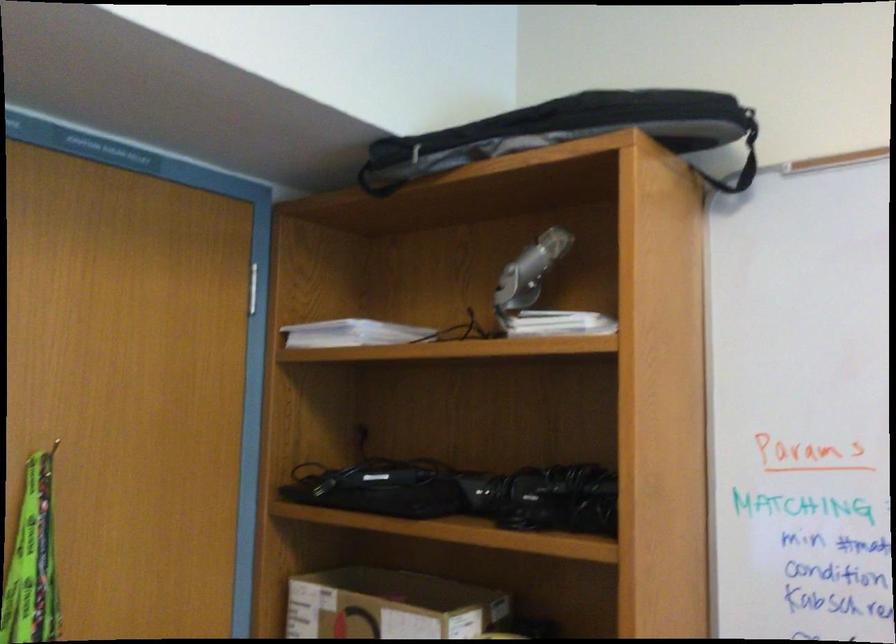
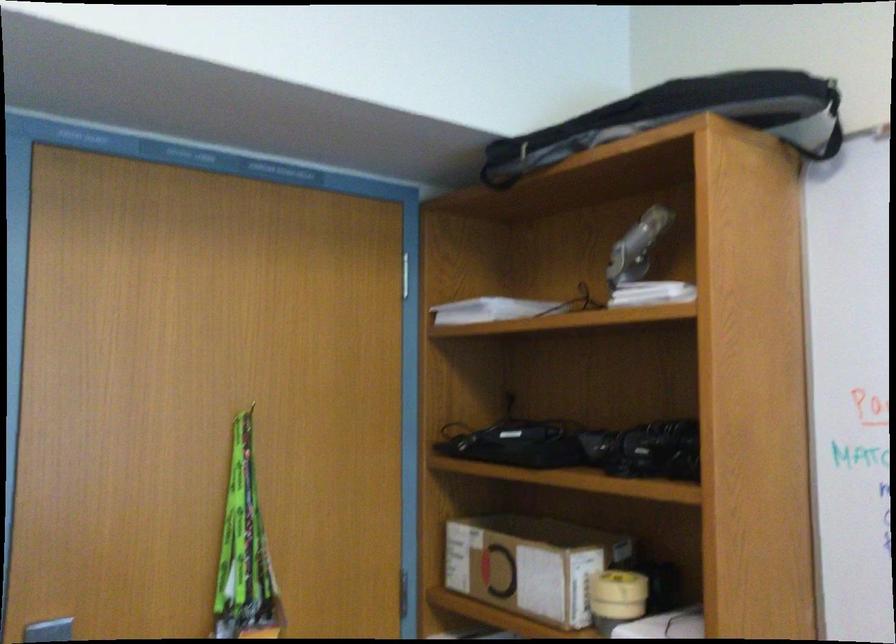
Locate, in the second image, the point that corresponds to [531,270] in the first image.

(636, 247)